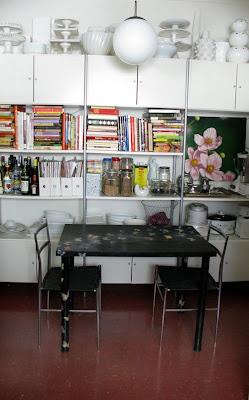
Where is `table legs`? The image size is (249, 400). table legs is located at coordinates [x=66, y=276], [x=202, y=299], [x=184, y=261], [x=70, y=259].